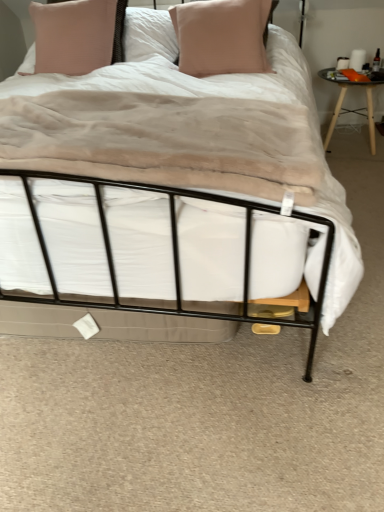
Question: Is there a large distance between matte pink pillow at upper center, positioned as the 1th pillow in left-to-right order, and black metal bed at center?

Choices:
 (A) yes
 (B) no

Answer: (B)

Question: Is matte pink pillow at upper center, which ranks as the 2th pillow in right-to-left order, not inside black metal bed at center?

Choices:
 (A) no
 (B) yes

Answer: (B)

Question: From the image's perspective, is matte pink pillow at upper center, which ranks as the 2th pillow in right-to-left order, located beneath black metal bed at center?

Choices:
 (A) no
 (B) yes

Answer: (A)

Question: Are matte pink pillow at upper center, positioned as the 1th pillow in left-to-right order, and black metal bed at center making contact?

Choices:
 (A) yes
 (B) no

Answer: (B)

Question: From a real-world perspective, does matte pink pillow at upper center, which ranks as the 2th pillow in right-to-left order, sit lower than black metal bed at center?

Choices:
 (A) no
 (B) yes

Answer: (A)

Question: Does matte pink pillow at upper center, which ranks as the 2th pillow in right-to-left order, have a lesser width compared to black metal bed at center?

Choices:
 (A) no
 (B) yes

Answer: (B)

Question: Does black glass table at right have a smaller size compared to pink fabric pillow at center, placed as the first pillow when sorted from right to left?

Choices:
 (A) yes
 (B) no

Answer: (A)

Question: Is black glass table at right to the left of pink fabric pillow at center, placed as the 2th pillow when sorted from left to right, from the viewer's perspective?

Choices:
 (A) no
 (B) yes

Answer: (A)

Question: Considering the relative sizes of black glass table at right and pink fabric pillow at center, placed as the 2th pillow when sorted from left to right, in the image provided, is black glass table at right bigger than pink fabric pillow at center, placed as the 2th pillow when sorted from left to right,?

Choices:
 (A) no
 (B) yes

Answer: (A)

Question: Does black glass table at right have a greater width compared to pink fabric pillow at center, placed as the 2th pillow when sorted from left to right?

Choices:
 (A) yes
 (B) no

Answer: (A)

Question: Is pink fabric pillow at center, placed as the first pillow when sorted from right to left, completely or partially inside black glass table at right?

Choices:
 (A) no
 (B) yes

Answer: (A)

Question: Can you confirm if black glass table at right is taller than pink fabric pillow at center, placed as the 2th pillow when sorted from left to right?

Choices:
 (A) yes
 (B) no

Answer: (A)

Question: Is black glass table at right completely or partially inside matte pink pillow at upper center, positioned as the 1th pillow in left-to-right order?

Choices:
 (A) yes
 (B) no

Answer: (B)